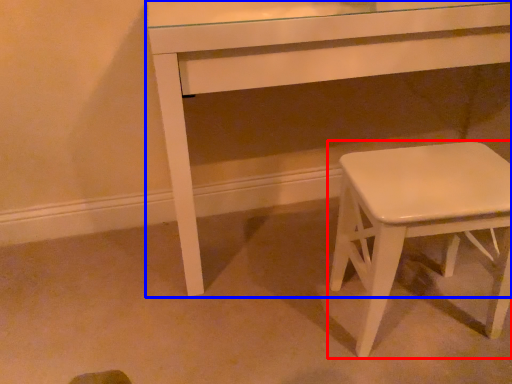
Question: Which object appears farthest to the camera in this image, stool (highlighted by a red box) or table (highlighted by a blue box)?

Choices:
 (A) stool
 (B) table

Answer: (B)